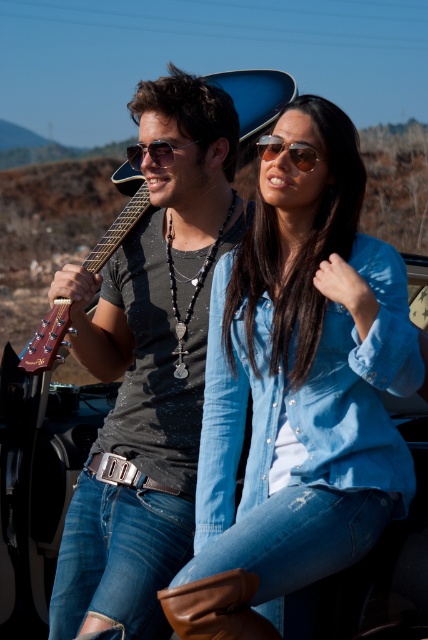
You are a photographer taking a picture of the matte black shirt at center and the wooden acoustic guitar at left. Which object should you focus on first if you want to capture both in sharp focus?

The matte black shirt at center is located below the wooden acoustic guitar at left, so you should focus on the wooden acoustic guitar at left first to ensure both are in sharp focus.

You are a photographer trying to capture a closeup shot of the denim shirt at center and the wooden acoustic guitar at left. Given that your camera can only focus on one object at a time, which object should you adjust the focus to first if you want to ensure the wider object is in sharp focus?

The denim shirt at center is wider than the wooden acoustic guitar at left, so you should adjust the focus to the denim shirt at center first to ensure it is in sharp focus.

You are a photographer trying to capture a closeup of the matte black shirt at center and the matte black sunglasses at center. Which object should you focus on first if you want to ensure both are in focus?

The matte black shirt at center is below matte black sunglasses at center, so you should focus on the matte black sunglasses at center first to ensure both are in focus.